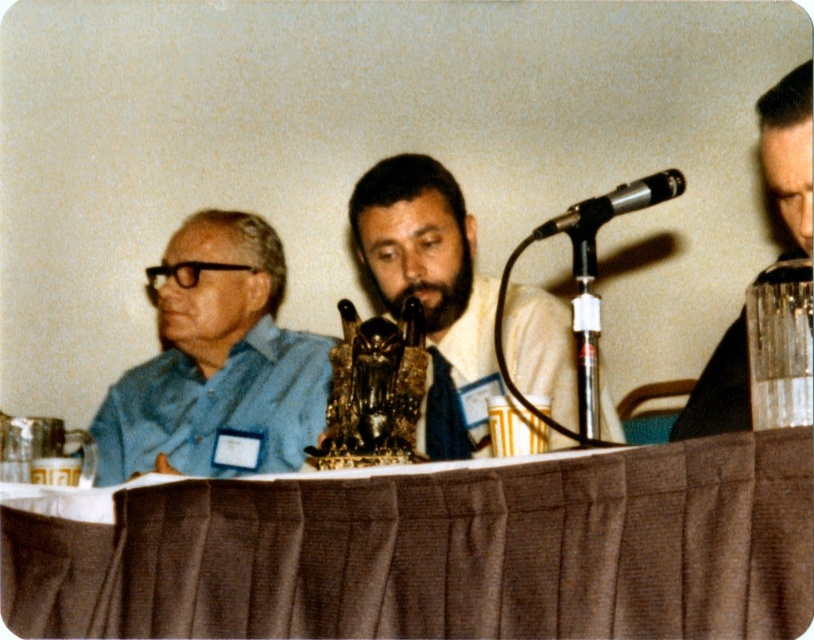
Identify the location of matte gold statue at center. (432, 289).

Is matte gold statue at center wider than black metallic microphone at upper right?

Yes, matte gold statue at center is wider than black metallic microphone at upper right.

You are a GUI agent. You are given a task and a screenshot of the screen. Output one action in this format:
    pyautogui.click(x=<x>, y=<y>)
    Task: Click on the matte gold statue at center
    Image resolution: width=814 pixels, height=640 pixels.
    Given the screenshot: What is the action you would take?
    pyautogui.click(x=432, y=289)

Locate an element on the screen. matte gold statue at center is located at coordinates (432, 289).

Is point (548, 230) positioned after point (414, 321)?

No, it is in front of (414, 321).

Locate an element on the screen. Image resolution: width=814 pixels, height=640 pixels. black metallic microphone at upper right is located at coordinates (611, 205).

Where is `black metallic microphone at upper right`? The image size is (814, 640). black metallic microphone at upper right is located at coordinates (611, 205).

Image resolution: width=814 pixels, height=640 pixels. Describe the element at coordinates (217, 364) in the screenshot. I see `blue matte shirt at left` at that location.

Does blue matte shirt at left come behind clear plastic glass at right?

Yes, it is behind clear plastic glass at right.

Which is behind, point (287, 381) or point (795, 125)?

The point (287, 381) is behind.

Locate an element on the screen. The width and height of the screenshot is (814, 640). blue matte shirt at left is located at coordinates (217, 364).